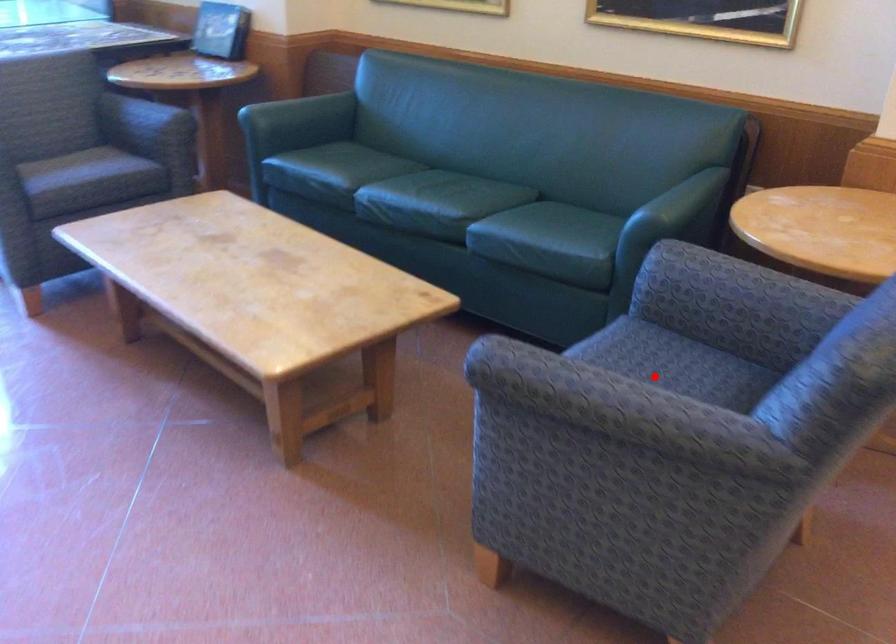
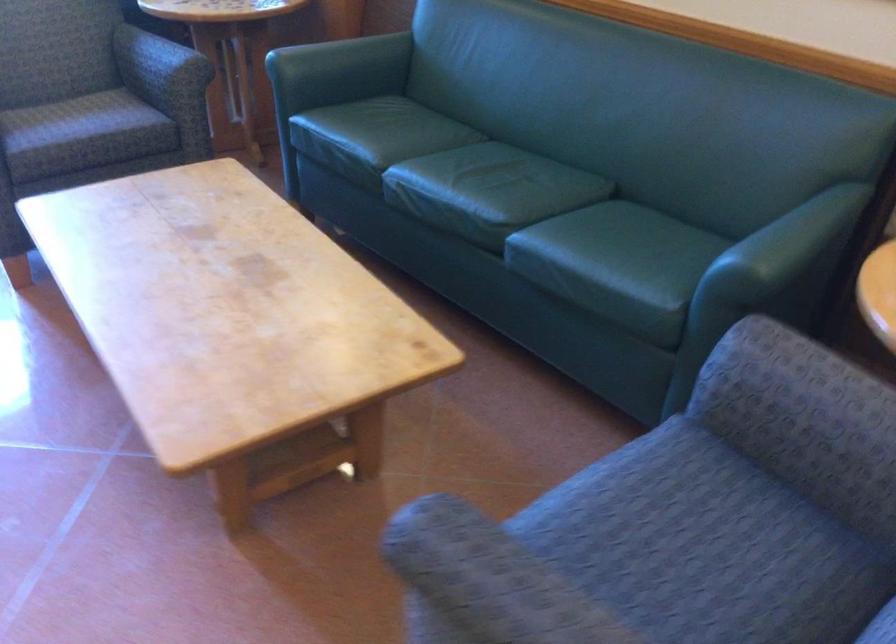
Question: I am providing you with two images of the same scene from different viewpoints. Given a red point in image1, look at the same physical point in image2. Is it:

Choices:
 (A) Closer to the viewpoint
 (B) Farther from the viewpoint

Answer: (A)